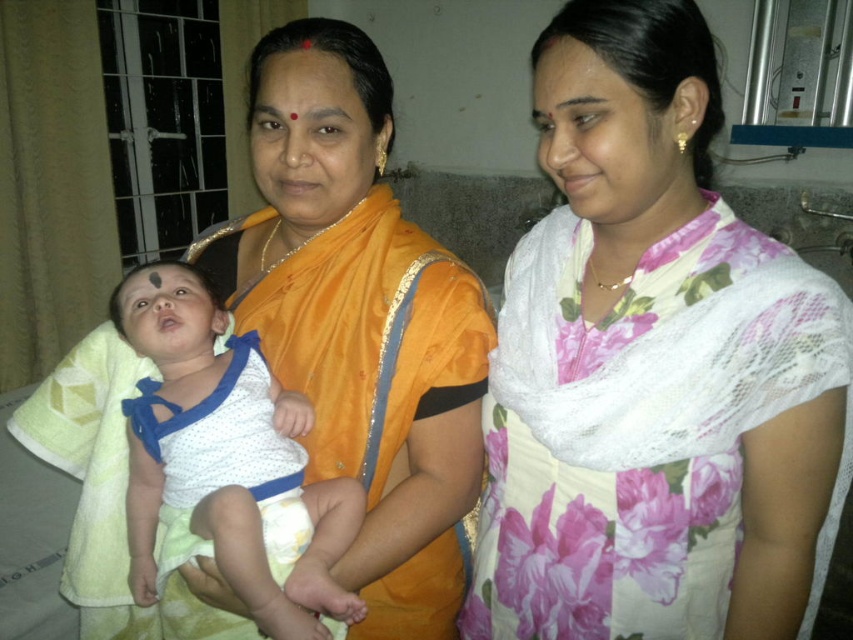
What do you see at coordinates (363, 333) in the screenshot? I see `orange silk saree at center` at bounding box center [363, 333].

Does point (315, 371) come farther from viewer compared to point (260, 92)?

Yes, it is behind point (260, 92).

You are a GUI agent. You are given a task and a screenshot of the screen. Output one action in this format:
    pyautogui.click(x=<x>, y=<y>)
    Task: Click on the orange silk saree at center
    
    Given the screenshot: What is the action you would take?
    point(363,333)

Between white floral saree at center and matte orange forehead at center, which one has more height?

Standing taller between the two is white floral saree at center.

Based on the photo, who is more distant from viewer, (x=593, y=458) or (x=328, y=51)?

Point (x=328, y=51)

I want to click on white floral saree at center, so click(x=653, y=368).

Is orange silk saree at center smaller than white dotted fabric at center?

No.

Between orange silk saree at center and white dotted fabric at center, which one appears on the left side from the viewer's perspective?

white dotted fabric at center

Which is in front, point (80, 460) or point (234, 420)?

Point (234, 420) is in front.

At what (x,y) coordinates should I click in order to perform the action: click on orange silk saree at center. Please return your answer as a coordinate pair (x, y). The width and height of the screenshot is (853, 640). Looking at the image, I should click on (363, 333).